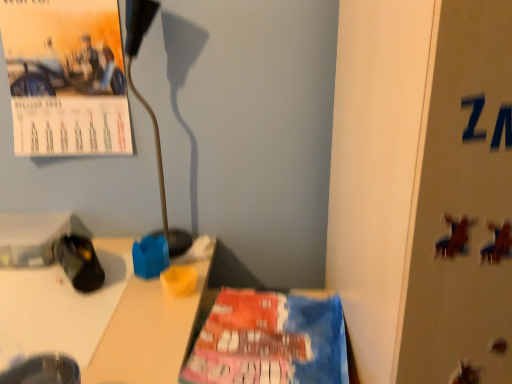
Question: Is matte paper calendar at upper left bigger than metallic gold lamp at upper left?

Choices:
 (A) no
 (B) yes

Answer: (B)

Question: From the image's perspective, is matte paper calendar at upper left below metallic gold lamp at upper left?

Choices:
 (A) yes
 (B) no

Answer: (B)

Question: From the image's perspective, is matte paper calendar at upper left located above metallic gold lamp at upper left?

Choices:
 (A) yes
 (B) no

Answer: (A)

Question: Is the position of matte paper calendar at upper left less distant than that of metallic gold lamp at upper left?

Choices:
 (A) yes
 (B) no

Answer: (B)

Question: Is metallic gold lamp at upper left surrounded by matte paper calendar at upper left?

Choices:
 (A) no
 (B) yes

Answer: (A)

Question: Is point (70, 105) positioned closer to the camera than point (80, 244)?

Choices:
 (A) closer
 (B) farther

Answer: (B)

Question: Looking at the image, does matte paper calendar at upper left seem bigger or smaller compared to black fabric shoe at lower left?

Choices:
 (A) big
 (B) small

Answer: (A)

Question: In terms of width, does matte paper calendar at upper left look wider or thinner when compared to black fabric shoe at lower left?

Choices:
 (A) thin
 (B) wide

Answer: (A)

Question: Is matte paper calendar at upper left in front of or behind black fabric shoe at lower left in the image?

Choices:
 (A) front
 (B) behind

Answer: (B)

Question: In terms of height, does metallic silver bulletin board at right look taller or shorter compared to black fabric shoe at lower left?

Choices:
 (A) tall
 (B) short

Answer: (A)

Question: From a real-world perspective, is metallic silver bulletin board at right positioned above or below black fabric shoe at lower left?

Choices:
 (A) above
 (B) below

Answer: (A)

Question: In terms of width, does metallic silver bulletin board at right look wider or thinner when compared to black fabric shoe at lower left?

Choices:
 (A) thin
 (B) wide

Answer: (B)

Question: Is metallic silver bulletin board at right bigger or smaller than black fabric shoe at lower left?

Choices:
 (A) big
 (B) small

Answer: (A)

Question: Considering the positions of point (145, 8) and point (463, 288), is point (145, 8) closer or farther from the camera than point (463, 288)?

Choices:
 (A) closer
 (B) farther

Answer: (B)

Question: Is metallic gold lamp at upper left wider or thinner than metallic silver bulletin board at right?

Choices:
 (A) thin
 (B) wide

Answer: (A)